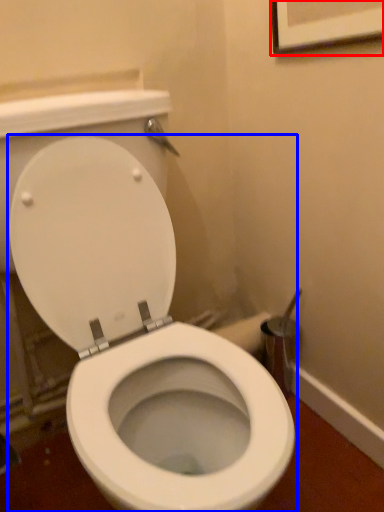
Question: Which object appears closest to the camera in this image, picture frame (highlighted by a red box) or toilet (highlighted by a blue box)?

Choices:
 (A) picture frame
 (B) toilet

Answer: (B)